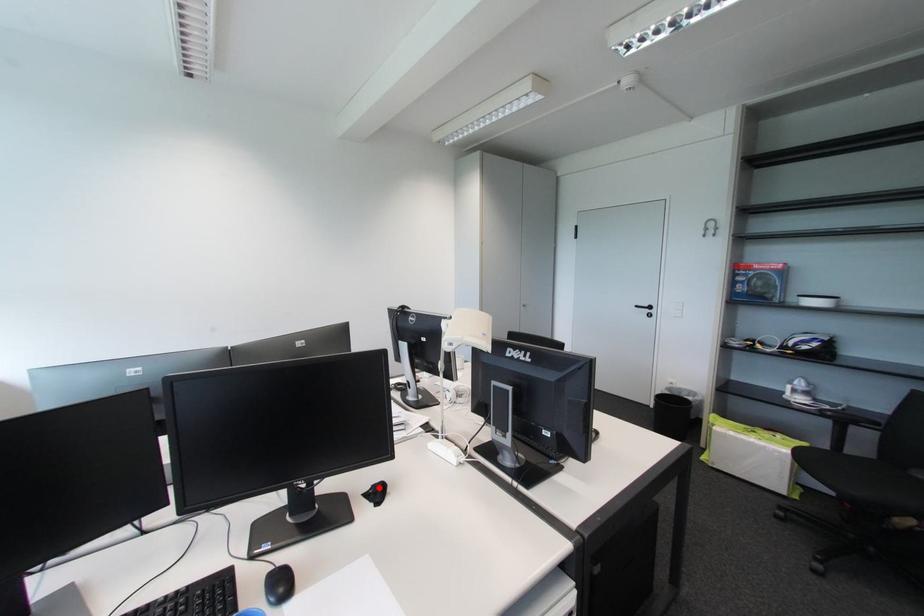
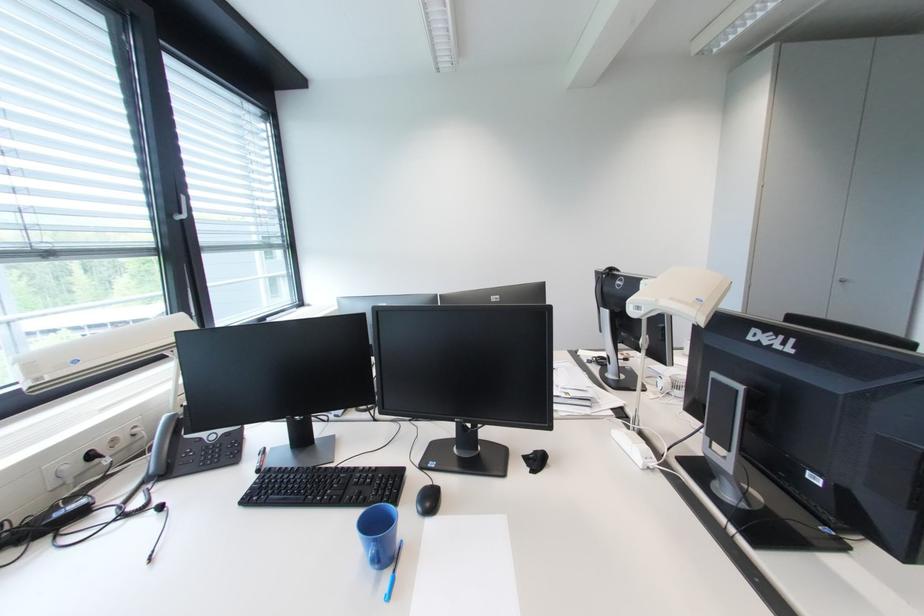
Question: I am providing you with two images of the same scene from different viewpoints. Given a red point in image1, look at the same physical point in image2. Is it:

Choices:
 (A) Closer to the viewpoint
 (B) Farther from the viewpoint

Answer: (A)